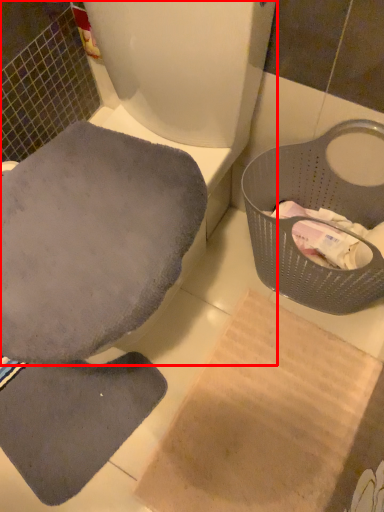
Question: From the image's perspective, where is toilet (annotated by the red box) located in relation to basket container in the image?

Choices:
 (A) below
 (B) above

Answer: (B)